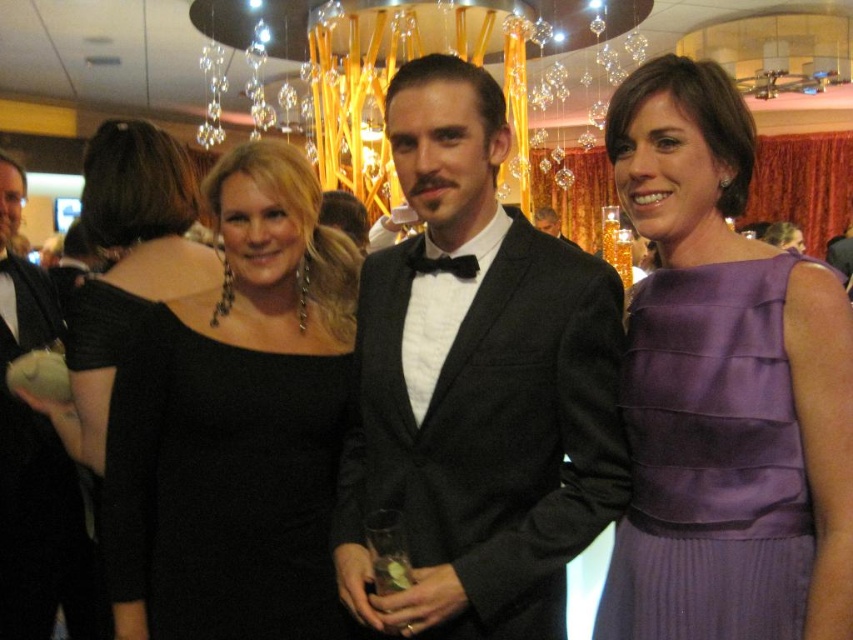
You are a photographer at the event and want to ensure both the black satin dress at center and the black satin bow tie at center are clearly visible in your photo. Given their sizes, which one might require more careful framing to avoid being too small in the image?

The black satin bow tie at center is smaller in size than the black satin dress at center, so it might require more careful framing to avoid being too small in the image.

You are a photographer at the event and want to ensure both the purple satin dress at center and the black satin bow tie at center are clearly visible in your photo. Considering their widths, which one might require more careful framing to avoid being cut off?

The purple satin dress at center is wider than the black satin bow tie at center, so it might require more careful framing to avoid being cut off.